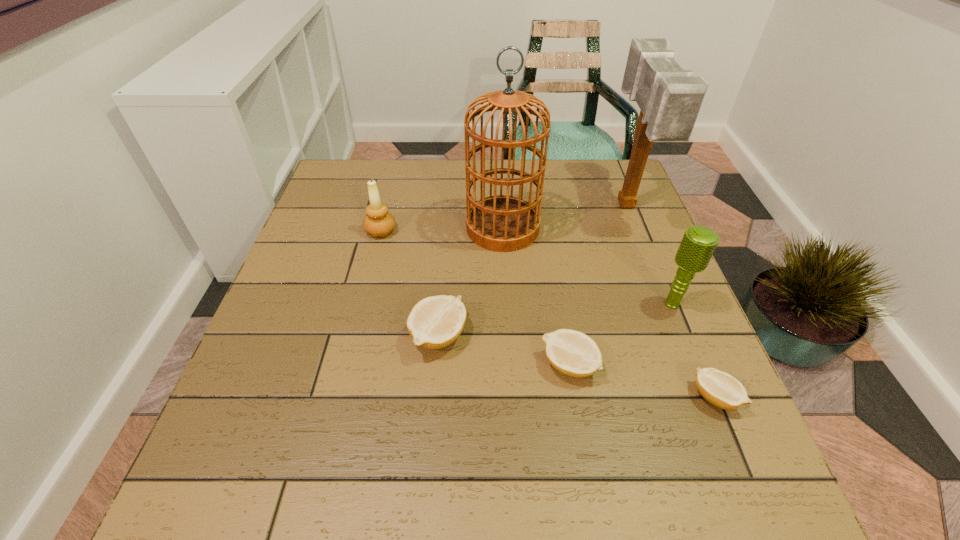
Identify the location of microphone. The width and height of the screenshot is (960, 540). (698, 244).

The image size is (960, 540). Identify the location of vacant space situated 0.240m on the right of the third shortest object. (584, 336).

Image resolution: width=960 pixels, height=540 pixels. Identify the location of free location located on the back of the second lemon from left to right. (553, 269).

Where is `blank space located 0.360m on the left of the shortest lemon`? blank space located 0.360m on the left of the shortest lemon is located at coordinates (496, 397).

Identify the location of vacant space located on the left of the mallet. Image resolution: width=960 pixels, height=540 pixels. (495, 207).

Locate an element on the screen. free spot located on the front of the birdcage is located at coordinates (508, 314).

This screenshot has height=540, width=960. I want to click on free space located 0.060m on the left of the candle_holder, so (342, 231).

The height and width of the screenshot is (540, 960). I want to click on free spot located on the front of the microphone, so click(x=696, y=362).

The width and height of the screenshot is (960, 540). I want to click on object present at the far edge, so click(x=669, y=98).

Image resolution: width=960 pixels, height=540 pixels. What are the coordinates of `object that is at the near edge` in the screenshot? It's located at (719, 388).